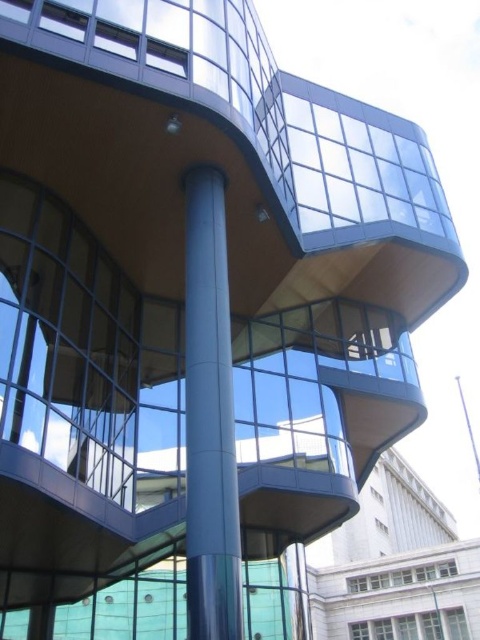
Can you confirm if satin silver column at center is smaller than blue metallic pole at center?

Indeed, satin silver column at center has a smaller size compared to blue metallic pole at center.

From the picture: Who is lower down, satin silver column at center or blue metallic pole at center?

→ blue metallic pole at center is lower down.

Identify the location of satin silver column at center. (210, 419).

You are a GUI agent. You are given a task and a screenshot of the screen. Output one action in this format:
    pyautogui.click(x=<x>, y=<y>)
    Task: Click on the satin silver column at center
    Image resolution: width=480 pixels, height=640 pixels.
    Given the screenshot: What is the action you would take?
    pyautogui.click(x=210, y=419)